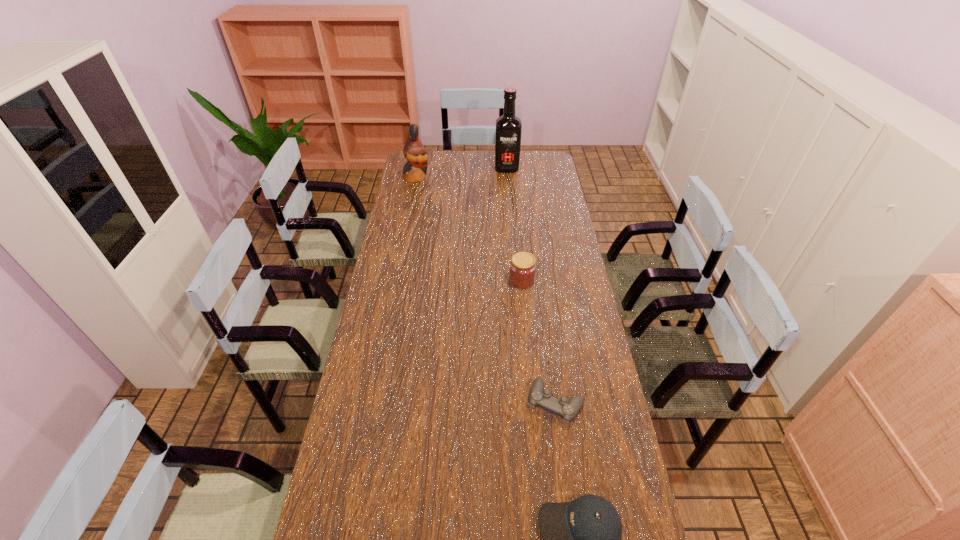
Where is `vacant space that satisfies the following two spatial constraints: 1. on the back side of the jam; 2. on the face of the leftmost object`? vacant space that satisfies the following two spatial constraints: 1. on the back side of the jam; 2. on the face of the leftmost object is located at coordinates (512, 177).

The height and width of the screenshot is (540, 960). Identify the location of vacant space that satisfies the following two spatial constraints: 1. on the face of the fourth shortest object; 2. on the left side of the third farthest object. (396, 281).

At what (x,y) coordinates should I click in order to perform the action: click on vacant area in the image that satisfies the following two spatial constraints: 1. on the front-facing side of the tallest object; 2. on the face of the second tallest object. Please return your answer as a coordinate pair (x, y). Image resolution: width=960 pixels, height=540 pixels. Looking at the image, I should click on (508, 177).